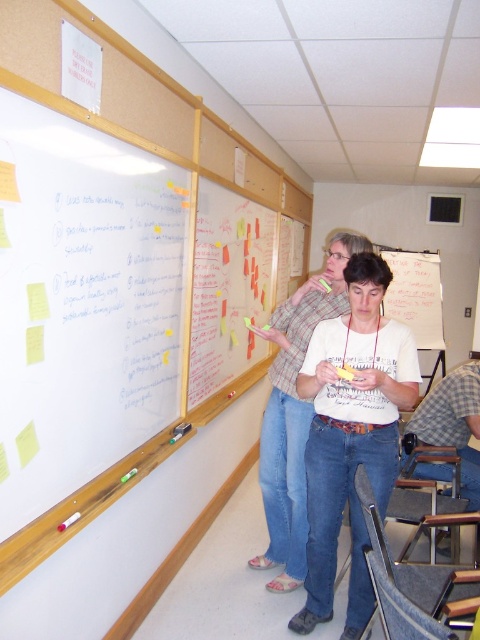
Between point (24, 465) and point (296, 621), which one is positioned behind?

The point (296, 621) is more distant.

Can you confirm if white matte dry erase board at upper left is wider than white cotton shirt at center?

No.

Is point (104, 289) less distant than point (392, 403)?

Yes, point (104, 289) is in front of point (392, 403).

Identify the location of white matte dry erase board at upper left. Image resolution: width=480 pixels, height=640 pixels. 83,301.